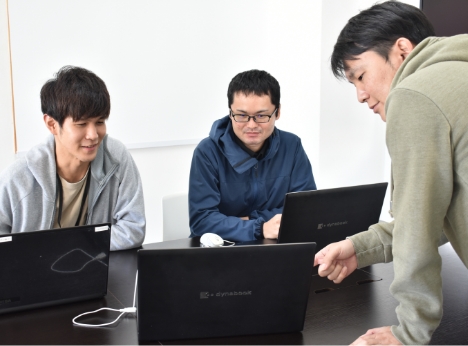
Find the location of a particular element. The image size is (468, 346). laptop is located at coordinates (51, 278), (218, 256), (343, 213).